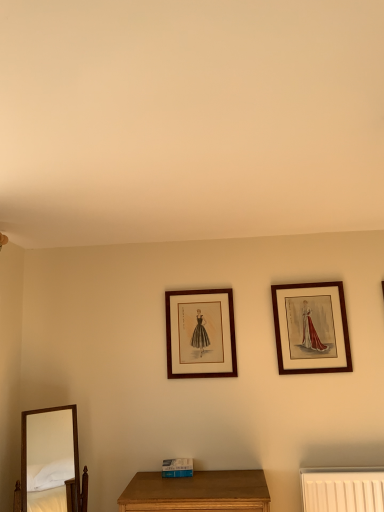
Question: Which direction should I rotate to face matte wood picture frame at center, marked as the first picture frame in a left-to-right arrangement, — up or down?

Choices:
 (A) down
 (B) up

Answer: (A)

Question: Is wooden mirror at lower left behind wooden framed print at upper right, arranged as the 1th picture frame when viewed from the right?

Choices:
 (A) no
 (B) yes

Answer: (A)

Question: Is wooden mirror at lower left turned away from wooden framed print at upper right, arranged as the 1th picture frame when viewed from the right?

Choices:
 (A) yes
 (B) no

Answer: (B)

Question: Is wooden mirror at lower left positioned beyond the bounds of wooden framed print at upper right, arranged as the 1th picture frame when viewed from the right?

Choices:
 (A) yes
 (B) no

Answer: (A)

Question: From the image's perspective, is wooden mirror at lower left located above wooden framed print at upper right, arranged as the 1th picture frame when viewed from the right?

Choices:
 (A) no
 (B) yes

Answer: (A)

Question: Is wooden mirror at lower left surrounding wooden framed print at upper right, arranged as the 1th picture frame when viewed from the right?

Choices:
 (A) yes
 (B) no

Answer: (B)

Question: Does wooden mirror at lower left appear on the left side of wooden framed print at upper right, the 2th picture frame viewed from the left?

Choices:
 (A) no
 (B) yes

Answer: (B)

Question: Can you confirm if wooden framed print at upper right, the 2th picture frame viewed from the left, is smaller than wooden mirror at lower left?

Choices:
 (A) no
 (B) yes

Answer: (B)

Question: Is wooden framed print at upper right, the 2th picture frame viewed from the left, in front of wooden mirror at lower left?

Choices:
 (A) yes
 (B) no

Answer: (B)

Question: Can you confirm if wooden framed print at upper right, the 2th picture frame viewed from the left, is taller than wooden mirror at lower left?

Choices:
 (A) no
 (B) yes

Answer: (A)

Question: Does wooden framed print at upper right, arranged as the 1th picture frame when viewed from the right, appear on the right side of wooden mirror at lower left?

Choices:
 (A) no
 (B) yes

Answer: (B)

Question: Is wooden framed print at upper right, the 2th picture frame viewed from the left, not close to wooden mirror at lower left?

Choices:
 (A) yes
 (B) no

Answer: (A)

Question: Considering the relative positions of wooden framed print at upper right, the 2th picture frame viewed from the left, and wooden mirror at lower left in the image provided, is wooden framed print at upper right, the 2th picture frame viewed from the left, to the left of wooden mirror at lower left from the viewer's perspective?

Choices:
 (A) yes
 (B) no

Answer: (B)

Question: Is the depth of wooden framed print at upper right, arranged as the 1th picture frame when viewed from the right, greater than that of matte wood picture frame at center, acting as the second picture frame starting from the right?

Choices:
 (A) no
 (B) yes

Answer: (A)